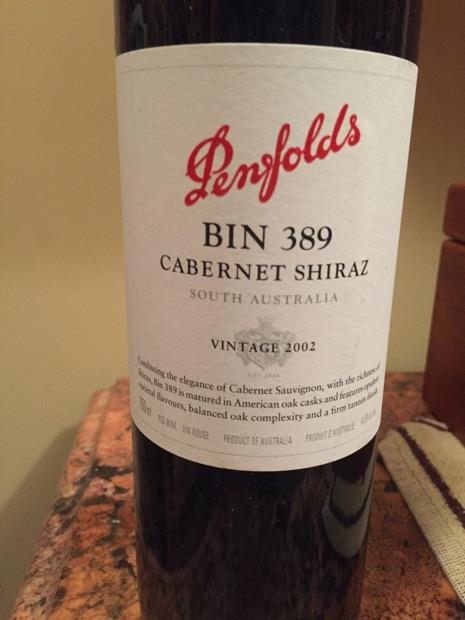
Where is `place to hold bottle for pouring`? The height and width of the screenshot is (620, 465). place to hold bottle for pouring is located at coordinates 398,235.